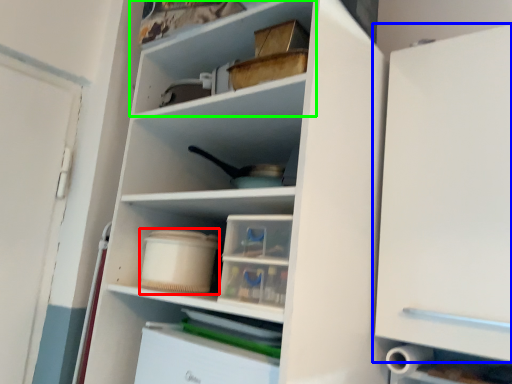
Question: Which is farther away from storage box (highlighted by a red box)? cabinetry (highlighted by a blue box) or shelf (highlighted by a green box)?

Choices:
 (A) cabinetry
 (B) shelf

Answer: (A)